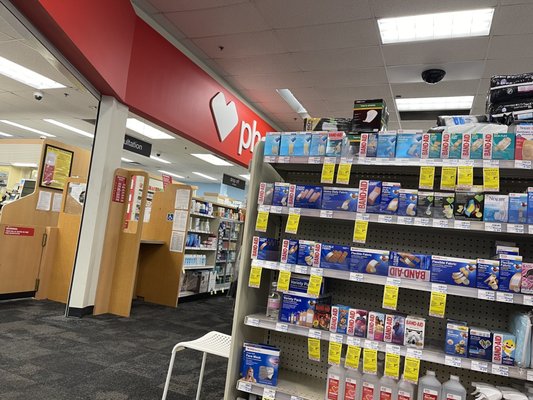
Locate an element on the screen. This screenshot has width=533, height=400. gray carpet is located at coordinates (117, 352).